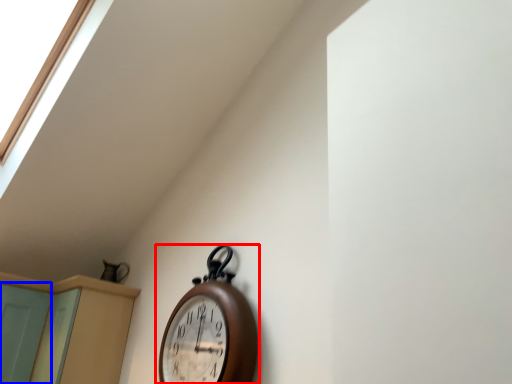
Question: Among these objects, which one is nearest to the camera, wall clock (highlighted by a red box) or screen door (highlighted by a blue box)?

Choices:
 (A) wall clock
 (B) screen door

Answer: (A)